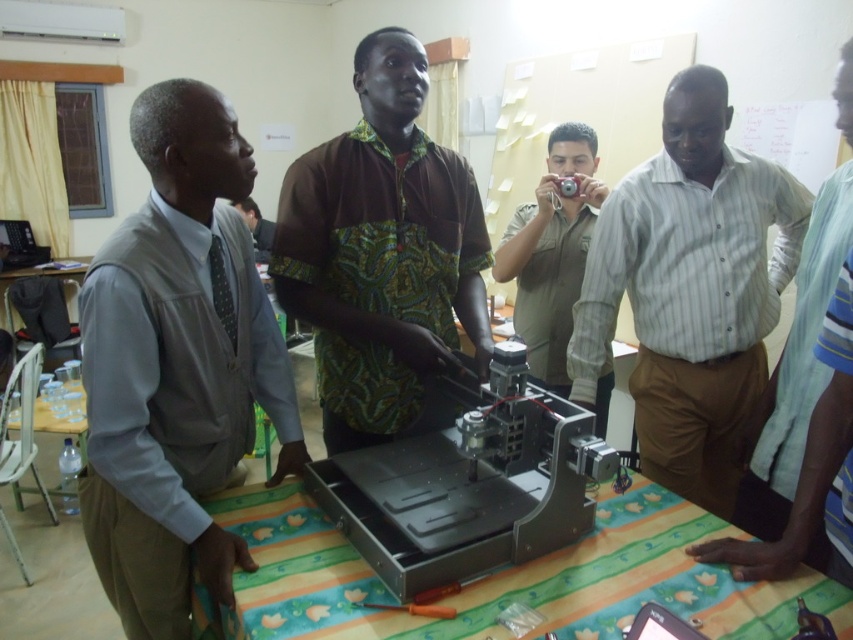
Question: Can you confirm if striped cotton shirt at center is wider than khaki uniform at center?

Choices:
 (A) no
 (B) yes

Answer: (B)

Question: Which of the following is the farthest from the observer?

Choices:
 (A) (329, 186)
 (B) (380, 566)
 (C) (270, 241)

Answer: (C)

Question: Can you confirm if light brown fabric vest at left is wider than khaki uniform at center?

Choices:
 (A) no
 (B) yes

Answer: (A)

Question: Can you confirm if light brown fabric vest at left is thinner than brown textured shirt at center?

Choices:
 (A) no
 (B) yes

Answer: (B)

Question: Which of these objects is positioned farthest from the light brown fabric vest at left?

Choices:
 (A) striped cotton shirt at center
 (B) brown textured shirt at center
 (C) matte black shirt at upper left

Answer: (C)

Question: Which object is the farthest from the metallic silver table at center?

Choices:
 (A) light brown fabric vest at left
 (B) striped cotton shirt at center
 (C) khaki uniform at center
 (D) metallic gray machine at center

Answer: (C)